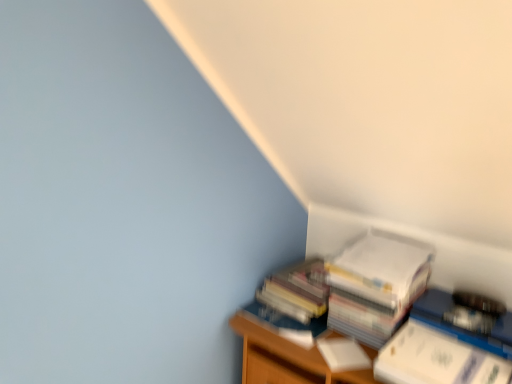
The image size is (512, 384). What are the coordinates of `free space above white paper stack at lower right (from a real-world perspective)` in the screenshot? It's located at (303, 278).